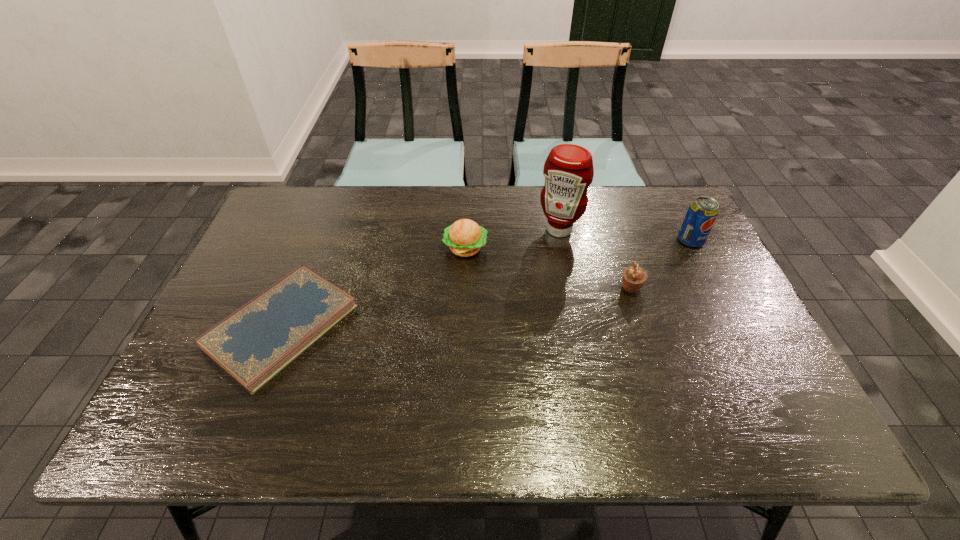
You are a GUI agent. You are given a task and a screenshot of the screen. Output one action in this format:
    pyautogui.click(x=<x>, y=<y>)
    Task: Click on the vacant space located 0.390m on the right of the hamburger
    Image resolution: width=960 pixels, height=540 pixels.
    Given the screenshot: What is the action you would take?
    pyautogui.click(x=619, y=248)

You are a GUI agent. You are given a task and a screenshot of the screen. Output one action in this format:
    pyautogui.click(x=<x>, y=<y>)
    Task: Click on the vacant space located 0.190m on the back of the fourth object from left to right
    The width and height of the screenshot is (960, 540).
    Given the screenshot: What is the action you would take?
    pyautogui.click(x=613, y=234)

I want to click on vacant space located on the back of the leftmost object, so click(x=311, y=253).

Where is `object located at the far edge`? object located at the far edge is located at coordinates (568, 170).

Locate an element on the screen. object that is at the left edge is located at coordinates (253, 344).

Where is `object at the right edge`? Image resolution: width=960 pixels, height=540 pixels. object at the right edge is located at coordinates (700, 217).

In the image, there is a desktop. Where is `vacant space at the far edge`? This screenshot has width=960, height=540. vacant space at the far edge is located at coordinates [527, 220].

Identify the location of free space at the near edge. (597, 444).

The height and width of the screenshot is (540, 960). In order to click on vacant point at the left edge in this screenshot , I will do `click(290, 269)`.

Locate an element on the screen. This screenshot has width=960, height=540. vacant position at the right edge of the desktop is located at coordinates (682, 310).